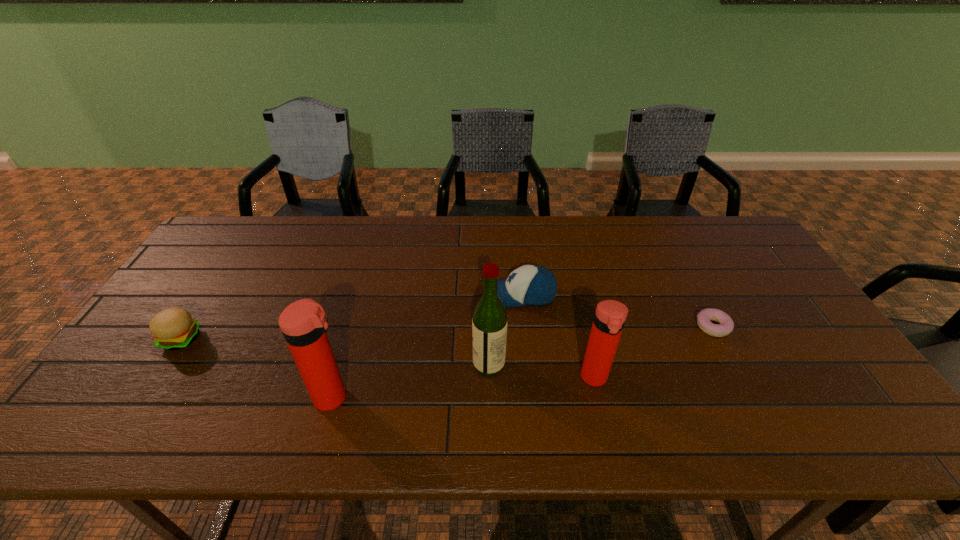
Identify the location of liquor. The height and width of the screenshot is (540, 960). (489, 323).

At what (x,y) coordinates should I click in order to perform the action: click on free space located on the left of the left thermos bottle. Please return your answer as a coordinate pair (x, y). This screenshot has height=540, width=960. Looking at the image, I should click on (195, 397).

The image size is (960, 540). In order to click on vacant area located on the left of the second object from right to left in this screenshot , I will do `click(540, 378)`.

At what (x,y) coordinates should I click in order to perform the action: click on free point located on the right of the doughnut. Please return your answer as a coordinate pair (x, y). This screenshot has width=960, height=540. Looking at the image, I should click on (758, 327).

Identify the location of free space located on the front-facing side of the baseball cap. The image size is (960, 540). (398, 295).

Identify the location of free space located on the front-facing side of the baseball cap. (385, 295).

The image size is (960, 540). Find the location of `free space located on the front-facing side of the baseball cap`. free space located on the front-facing side of the baseball cap is located at coordinates (453, 295).

Where is `free point located on the back of the leftmost object`? The height and width of the screenshot is (540, 960). free point located on the back of the leftmost object is located at coordinates (219, 280).

I want to click on free spot located 0.140m on the label of the liquor, so click(418, 364).

Where is `free point located on the label of the liquor`? The image size is (960, 540). free point located on the label of the liquor is located at coordinates (338, 364).